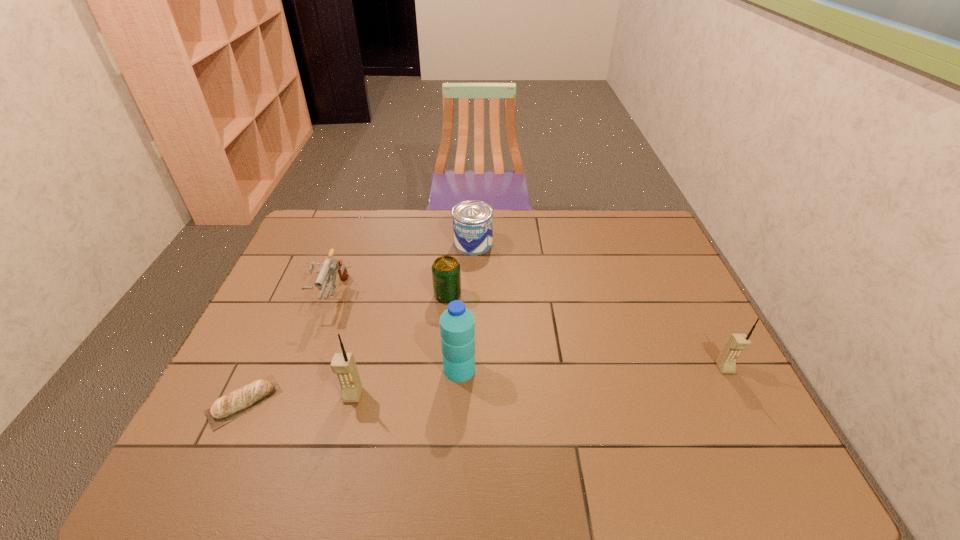
To achieve even spacing by inserting another cellular_telephone among them, please point to a vacant spot for this new cellular_telephone. Please provide its 2D coordinates. Your answer should be formatted as a tuple, i.e. [(x, y)], where the tuple contains the x and y coordinates of a point satisfying the conditions above.

[(544, 381)]